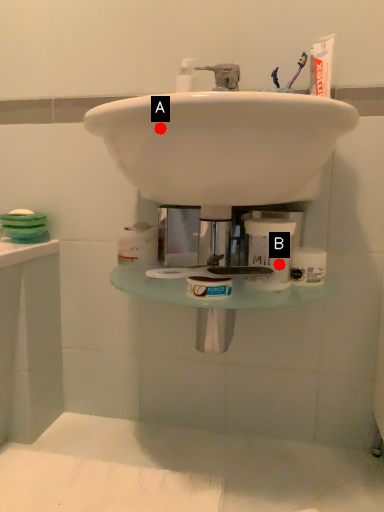
Question: Two points are circled on the image, labeled by A and B beside each circle. Which of the following is the farthest from the observer?

Choices:
 (A) A is further
 (B) B is further

Answer: (B)